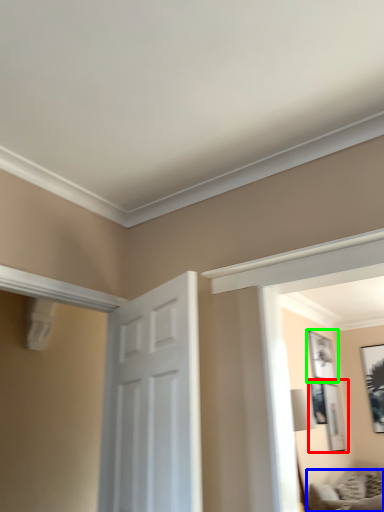
Question: Estimate the real-world distances between objects in this image. Which object is closer to picture frame (highlighted by a red box), furniture (highlighted by a blue box) or picture frame (highlighted by a green box)?

Choices:
 (A) furniture
 (B) picture frame

Answer: (B)